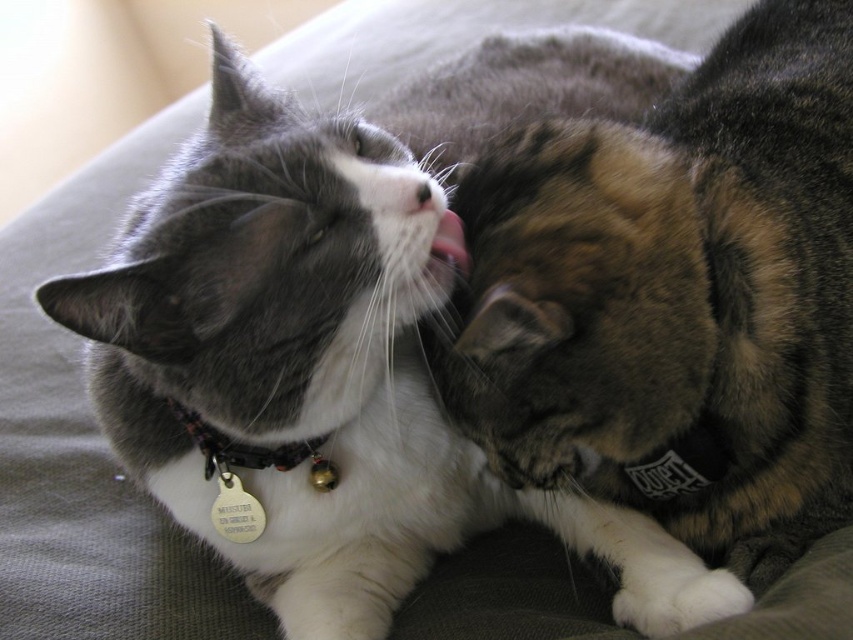
Which is behind, point (747, 422) or point (323, 468)?

Point (323, 468)

Does tabby fur cat at center have a smaller size compared to black fabric collar at left?

Incorrect, tabby fur cat at center is not smaller in size than black fabric collar at left.

In order to click on tabby fur cat at center in this screenshot , I will do `click(674, 298)`.

Which of these two, tabby fur cat at center or pink flesh at center, stands shorter?

pink flesh at center

In the scene shown: Measure the distance from tabby fur cat at center to pink flesh at center.

They are 31.14 centimeters apart.

Which is behind, point (671, 211) or point (432, 243)?

Point (432, 243)

Identify the location of tabby fur cat at center. (674, 298).

Who is positioned more to the left, tabby fur cat at center or white fur at center?

white fur at center

Does tabby fur cat at center come in front of white fur at center?

That is True.

You are a GUI agent. You are given a task and a screenshot of the screen. Output one action in this format:
    pyautogui.click(x=<x>, y=<y>)
    Task: Click on the tabby fur cat at center
    This screenshot has height=640, width=853.
    Given the screenshot: What is the action you would take?
    pyautogui.click(x=674, y=298)